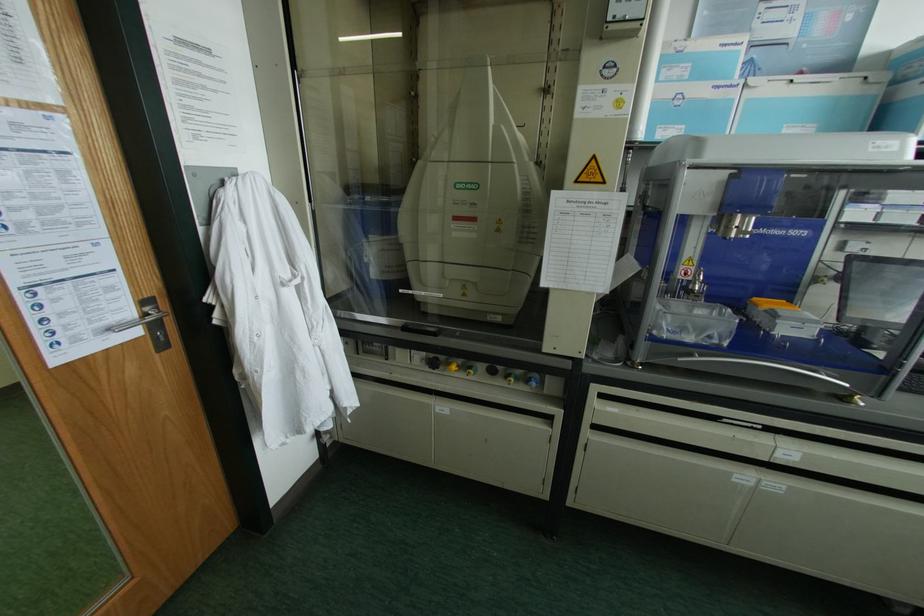
This screenshot has height=616, width=924. What do you see at coordinates (469, 369) in the screenshot? I see `the green control knob` at bounding box center [469, 369].